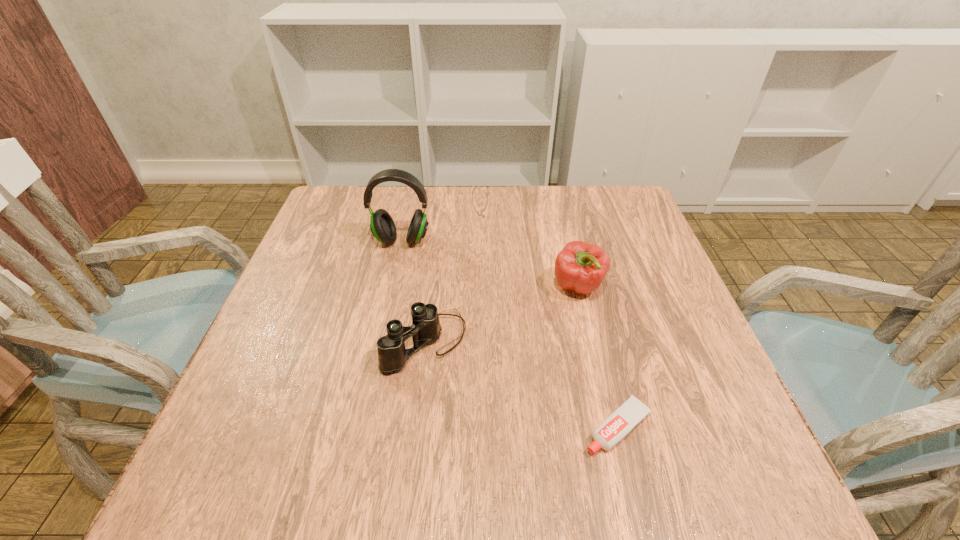
Image resolution: width=960 pixels, height=540 pixels. Find the location of `free space between the nearest object and the second farthest object`. free space between the nearest object and the second farthest object is located at coordinates (598, 357).

Where is `unoccupied position between the bell pepper and the third tallest object`? The width and height of the screenshot is (960, 540). unoccupied position between the bell pepper and the third tallest object is located at coordinates (502, 314).

You are a GUI agent. You are given a task and a screenshot of the screen. Output one action in this format:
    pyautogui.click(x=<x>, y=<y>)
    Task: Click on the blank region between the farthest object and the second farthest object
    
    Given the screenshot: What is the action you would take?
    pyautogui.click(x=490, y=264)

Point out which object is positioned as the third nearest to the second shortest object. Please provide its 2D coordinates. Your answer should be formatted as a tuple, i.e. [(x, y)], where the tuple contains the x and y coordinates of a point satisfying the conditions above.

[(630, 413)]

Select which object is the second closest to the third shortest object. Please provide its 2D coordinates. Your answer should be formatted as a tuple, i.e. [(x, y)], where the tuple contains the x and y coordinates of a point satisfying the conditions above.

[(630, 413)]

At what (x,y) coordinates should I click in order to perform the action: click on vacant space that satisfies the following two spatial constraints: 1. on the back side of the third farthest object; 2. on the left side of the third shortest object. Please return your answer as a coordinate pair (x, y). Looking at the image, I should click on (432, 287).

Identify the location of vacant area that satisfies the following two spatial constraints: 1. on the ear cups of the headset; 2. on the right side of the second shortest object. The image size is (960, 540). (379, 342).

You are a GUI agent. You are given a task and a screenshot of the screen. Output one action in this format:
    pyautogui.click(x=<x>, y=<y>)
    Task: Click on the blank space that satisfies the following two spatial constraints: 1. on the ear cups of the tallest object; 2. on the right side of the binoculars
    Image resolution: width=960 pixels, height=540 pixels.
    Given the screenshot: What is the action you would take?
    pyautogui.click(x=379, y=342)